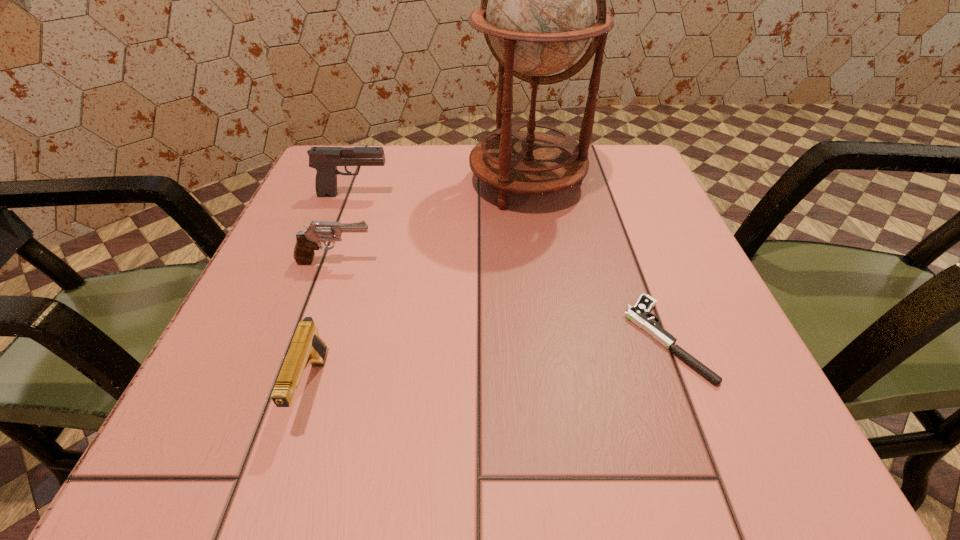
In the image, there is a desktop. Where is `vacant space at the far edge`? The image size is (960, 540). vacant space at the far edge is located at coordinates (435, 201).

At what (x,y) coordinates should I click in order to perform the action: click on free space at the left edge of the desktop. Please return your answer as a coordinate pair (x, y). Looking at the image, I should click on (192, 398).

In the image, there is a desktop. Identify the location of blank space at the right edge. (652, 342).

You are a GUI agent. You are given a task and a screenshot of the screen. Output one action in this format:
    pyautogui.click(x=<x>, y=<y>)
    Task: Click on the vacant space at the near left corner of the desktop
    
    Given the screenshot: What is the action you would take?
    pyautogui.click(x=178, y=475)

Image resolution: width=960 pixels, height=540 pixels. In the image, there is a desktop. Find the location of `free region at the far right corner`. free region at the far right corner is located at coordinates [601, 160].

I want to click on unoccupied position between the shortest object and the third nearest object, so click(500, 300).

Identify the location of free space that is in between the third nearest object and the rightmost pistol. (500, 300).

Find the location of `blank region between the tallest object and the third farthest object`. blank region between the tallest object and the third farthest object is located at coordinates (431, 222).

The image size is (960, 540). In order to click on empty space that is in between the tallest object and the shortest object in this screenshot , I will do `click(596, 261)`.

Locate which object ranks second in proximity to the shortest object. Please provide its 2D coordinates. Your answer should be formatted as a tuple, i.e. [(x, y)], where the tuple contains the x and y coordinates of a point satisfying the conditions above.

[(307, 241)]